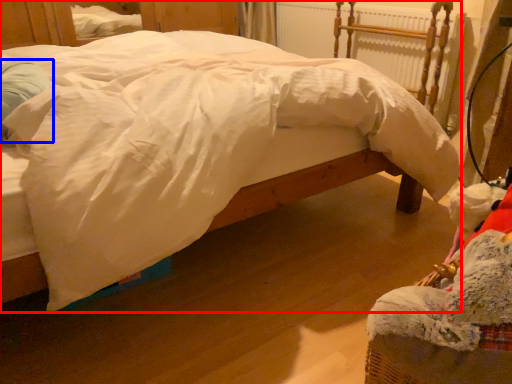
Question: Which of the following is the closest to the observer, bed (highlighted by a red box) or pillow (highlighted by a blue box)?

Choices:
 (A) bed
 (B) pillow

Answer: (A)